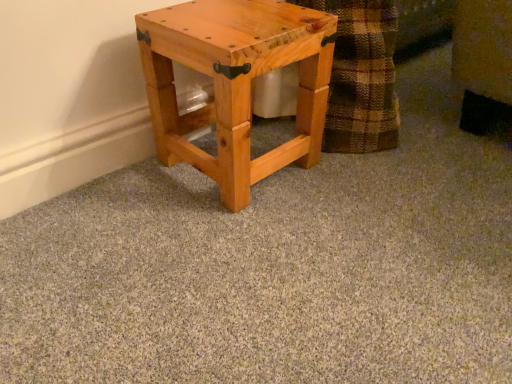
This screenshot has width=512, height=384. What are the coordinates of `free space in front of natural wood stool at lower center` in the screenshot? It's located at (232, 231).